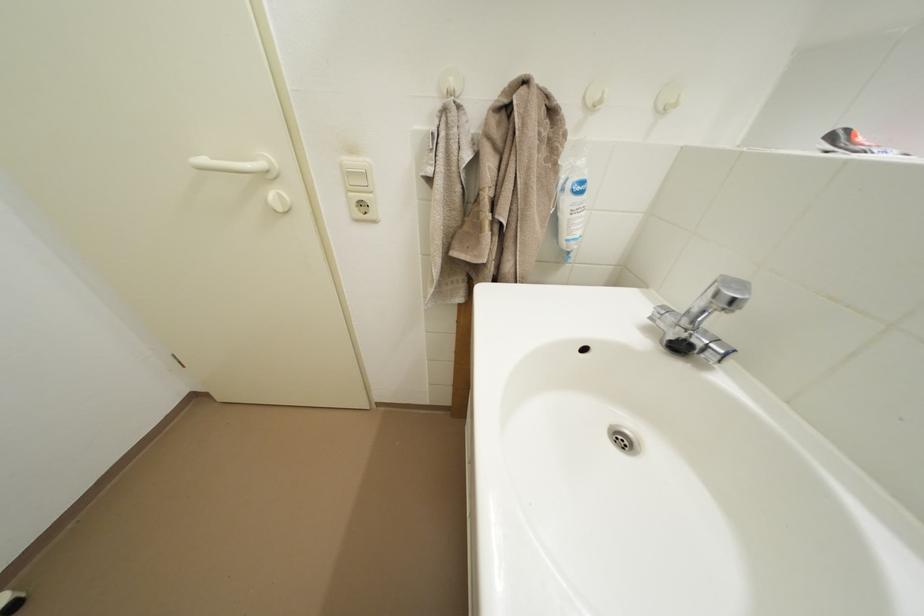
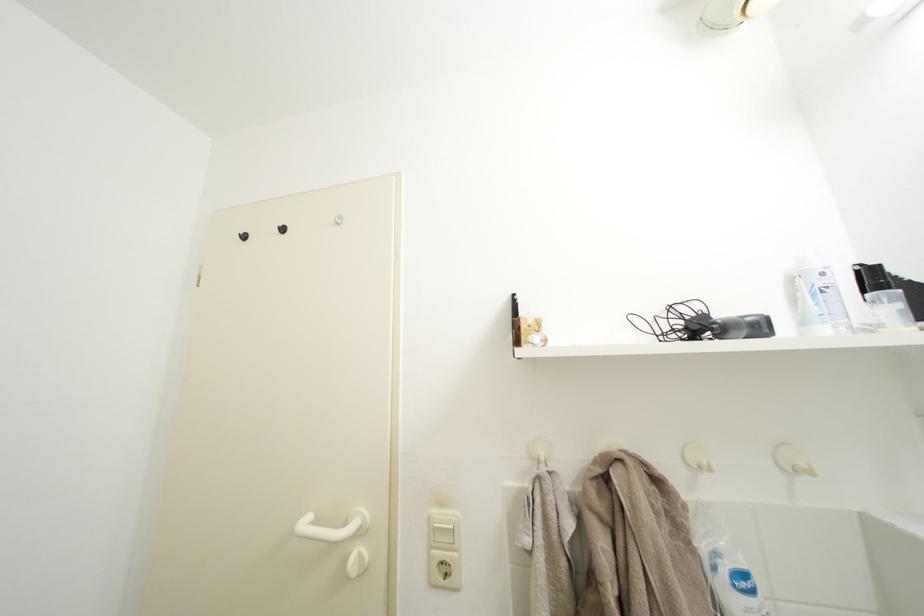
Question: How did the camera likely rotate?

Choices:
 (A) Left
 (B) Right
 (C) Up
 (D) Down

Answer: (C)